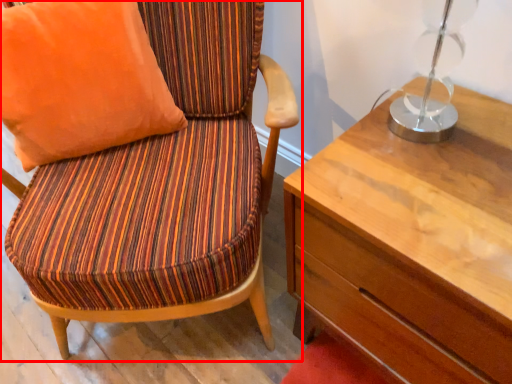
Question: In this image, where is chair (annotated by the red box) located relative to pillow?

Choices:
 (A) right
 (B) left

Answer: (A)